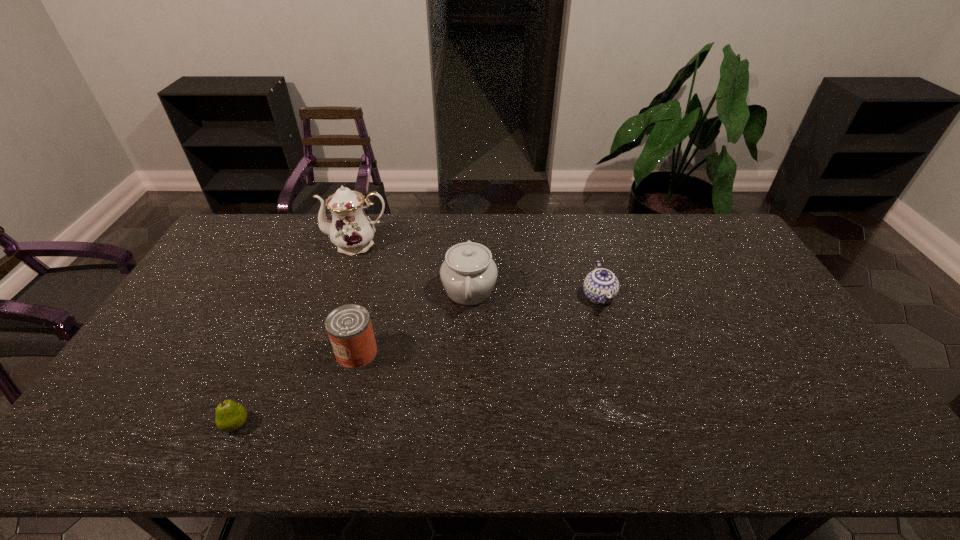
This screenshot has width=960, height=540. Find the location of `the farthest chinaware`. the farthest chinaware is located at coordinates (350, 229).

At what (x,y) coordinates should I click in order to perform the action: click on the farthest object. Please return your answer as a coordinate pair (x, y). Looking at the image, I should click on (350, 229).

Find the location of a particular element. the fourth object from left to right is located at coordinates (468, 274).

Where is `the second tallest chinaware`? The height and width of the screenshot is (540, 960). the second tallest chinaware is located at coordinates (468, 274).

I want to click on the fourth farthest object, so click(x=349, y=328).

You are a GUI agent. You are given a task and a screenshot of the screen. Output one action in this format:
    pyautogui.click(x=<x>, y=<y>)
    Task: Click on the can
    
    Given the screenshot: What is the action you would take?
    pyautogui.click(x=349, y=328)

The width and height of the screenshot is (960, 540). Find the location of `the rightmost object`. the rightmost object is located at coordinates (601, 286).

The height and width of the screenshot is (540, 960). I want to click on the rightmost chinaware, so click(601, 286).

Image resolution: width=960 pixels, height=540 pixels. Identify the location of the nearest object. (230, 416).

The height and width of the screenshot is (540, 960). What are the coordinates of `vacant space situated on the left of the tallest chinaware` in the screenshot? It's located at (266, 244).